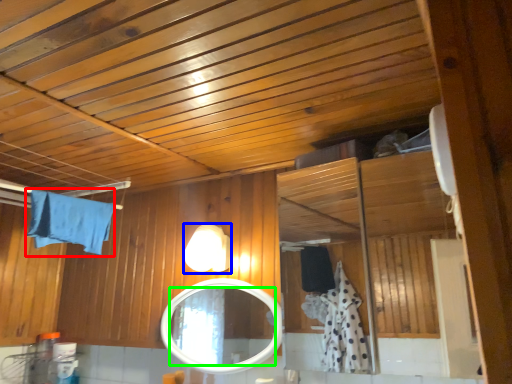
Question: Which object is the closest to the bath towel (highlighted by a red box)? Choose among these: light fixture (highlighted by a blue box) or mirror (highlighted by a green box).

Choices:
 (A) light fixture
 (B) mirror

Answer: (A)